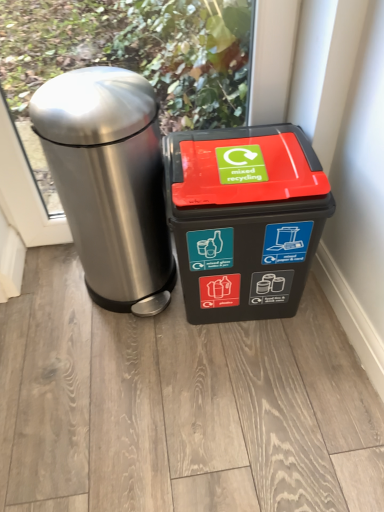
Locate an element on the screen. This screenshot has height=512, width=384. vacant position to the left of polished stainless steel trash can at left, arranged as the second waste container when viewed from the right is located at coordinates (44, 298).